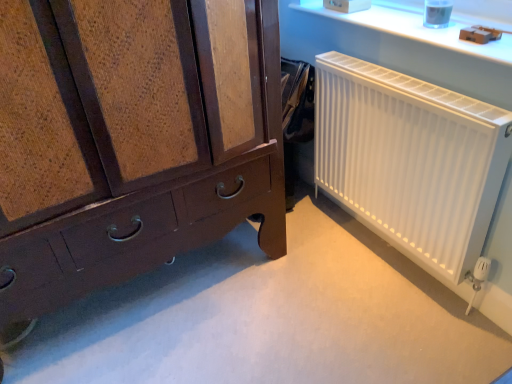
Question: Is white plastic radiator at upper right bigger than matte brown wooden chest of drawers at lower left?

Choices:
 (A) yes
 (B) no

Answer: (B)

Question: Considering the relative positions of white plastic radiator at upper right and matte brown wooden chest of drawers at lower left in the image provided, is white plastic radiator at upper right to the right of matte brown wooden chest of drawers at lower left from the viewer's perspective?

Choices:
 (A) no
 (B) yes

Answer: (B)

Question: Considering the relative sizes of white plastic radiator at upper right and matte brown wooden chest of drawers at lower left in the image provided, is white plastic radiator at upper right thinner than matte brown wooden chest of drawers at lower left?

Choices:
 (A) yes
 (B) no

Answer: (A)

Question: Is matte brown wooden chest of drawers at lower left inside white plastic radiator at upper right?

Choices:
 (A) yes
 (B) no

Answer: (B)

Question: Would you say white plastic radiator at upper right is outside matte brown wooden chest of drawers at lower left?

Choices:
 (A) no
 (B) yes

Answer: (B)

Question: Based on their sizes in the image, would you say white matte radiator at right is bigger or smaller than matte brown wooden chest of drawers at lower left?

Choices:
 (A) small
 (B) big

Answer: (A)

Question: Is white matte radiator at right in front of or behind matte brown wooden chest of drawers at lower left in the image?

Choices:
 (A) front
 (B) behind

Answer: (B)

Question: In the image, is white matte radiator at right on the left side or the right side of matte brown wooden chest of drawers at lower left?

Choices:
 (A) left
 (B) right

Answer: (B)

Question: From the image's perspective, is white matte radiator at right above or below matte brown wooden chest of drawers at lower left?

Choices:
 (A) below
 (B) above

Answer: (A)

Question: From the image's perspective, is matte brown wooden chest of drawers at lower left located above or below white matte radiator at right?

Choices:
 (A) above
 (B) below

Answer: (A)

Question: Is matte brown wooden chest of drawers at lower left taller or shorter than white matte radiator at right?

Choices:
 (A) tall
 (B) short

Answer: (A)

Question: Considering their positions, is matte brown wooden chest of drawers at lower left located in front of or behind white matte radiator at right?

Choices:
 (A) behind
 (B) front

Answer: (B)

Question: Considering the positions of matte brown wooden chest of drawers at lower left and white matte radiator at right in the image, is matte brown wooden chest of drawers at lower left bigger or smaller than white matte radiator at right?

Choices:
 (A) small
 (B) big

Answer: (B)

Question: Considering the positions of white plastic radiator at upper right and matte brown wooden chest of drawers at lower left in the image, is white plastic radiator at upper right bigger or smaller than matte brown wooden chest of drawers at lower left?

Choices:
 (A) big
 (B) small

Answer: (B)

Question: In terms of width, does white plastic radiator at upper right look wider or thinner when compared to matte brown wooden chest of drawers at lower left?

Choices:
 (A) wide
 (B) thin

Answer: (B)